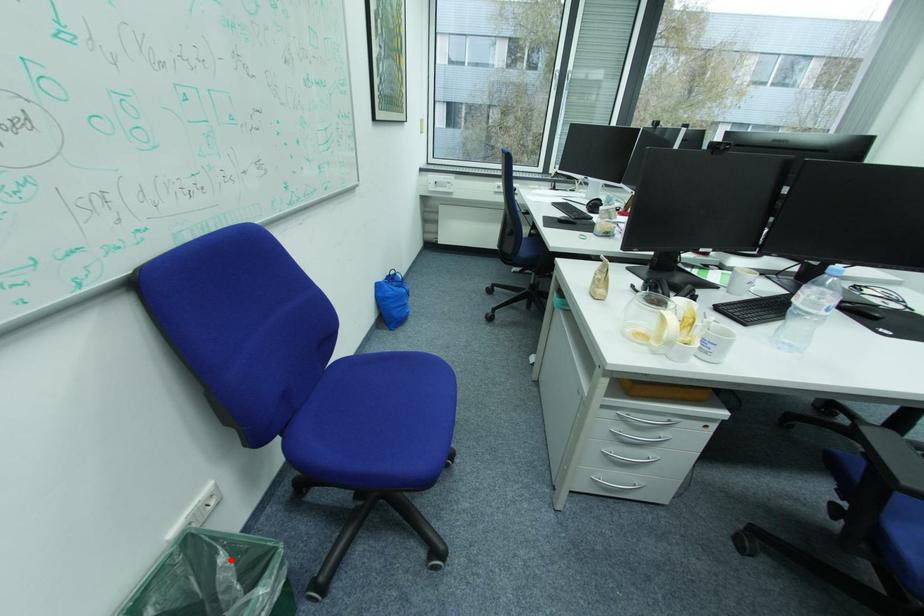
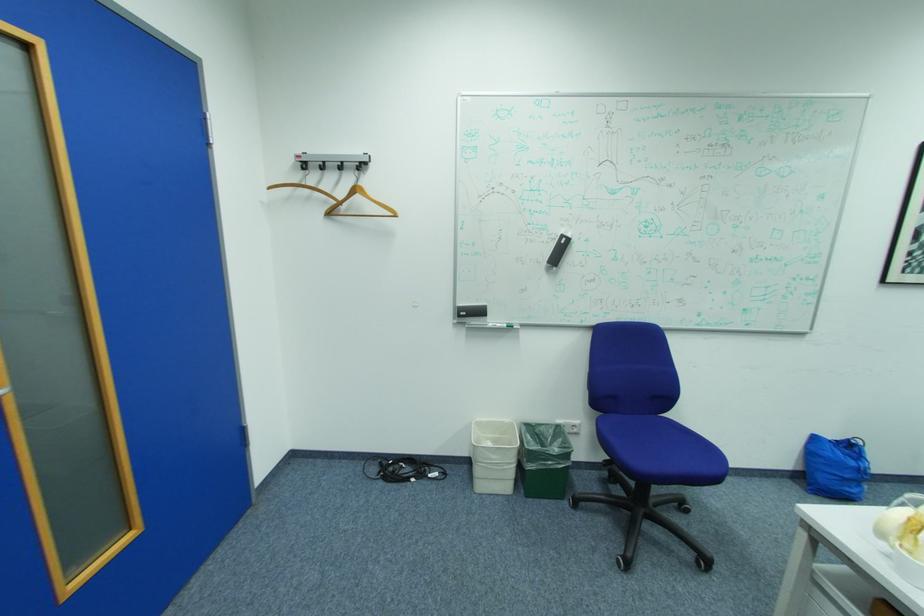
Where in the second image is the point corresponding to the highlighted location from the first image?

(568, 440)